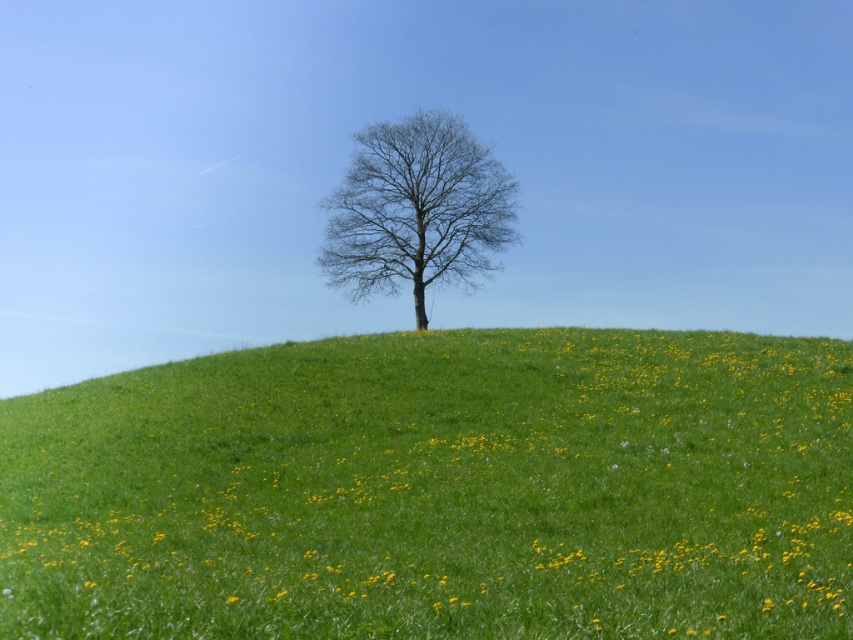
Who is positioned more to the right, green grassy hillside at center or bare branches at center?

Positioned to the right is bare branches at center.

The height and width of the screenshot is (640, 853). What do you see at coordinates (439, 490) in the screenshot? I see `green grassy hillside at center` at bounding box center [439, 490].

At what (x,y) coordinates should I click in order to perform the action: click on green grassy hillside at center. Please return your answer as a coordinate pair (x, y). This screenshot has height=640, width=853. Looking at the image, I should click on (439, 490).